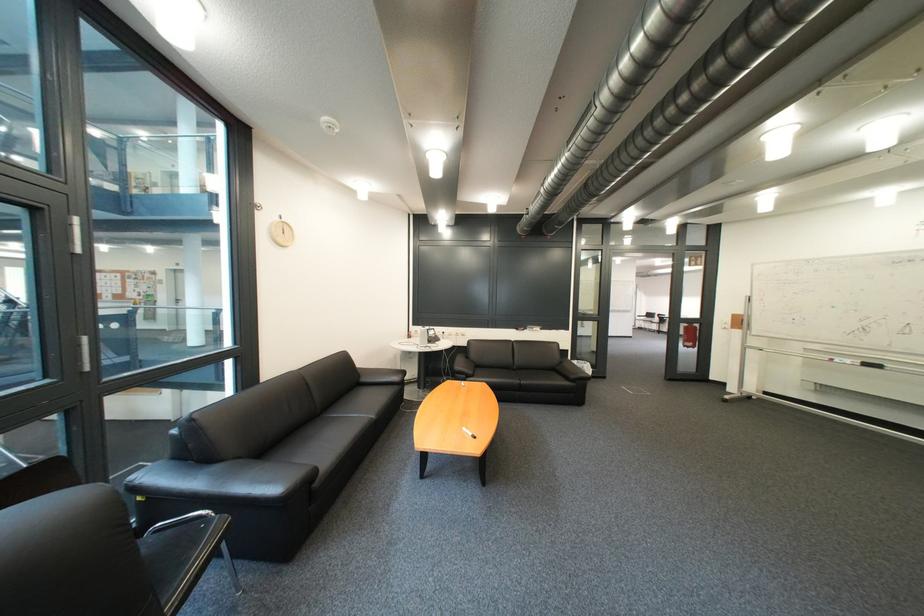
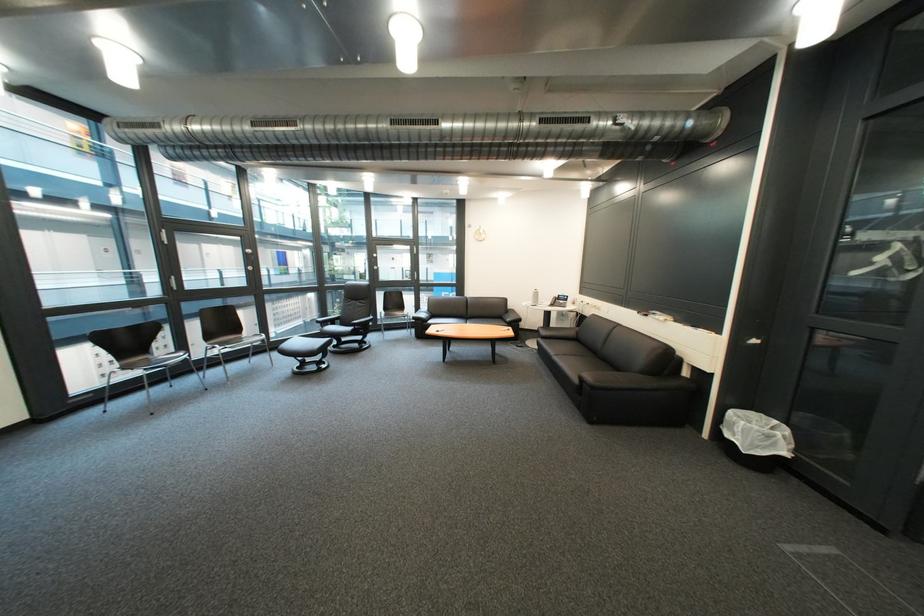
Find the pixel in the second image that matches (x=487, y=377) in the first image.

(556, 339)